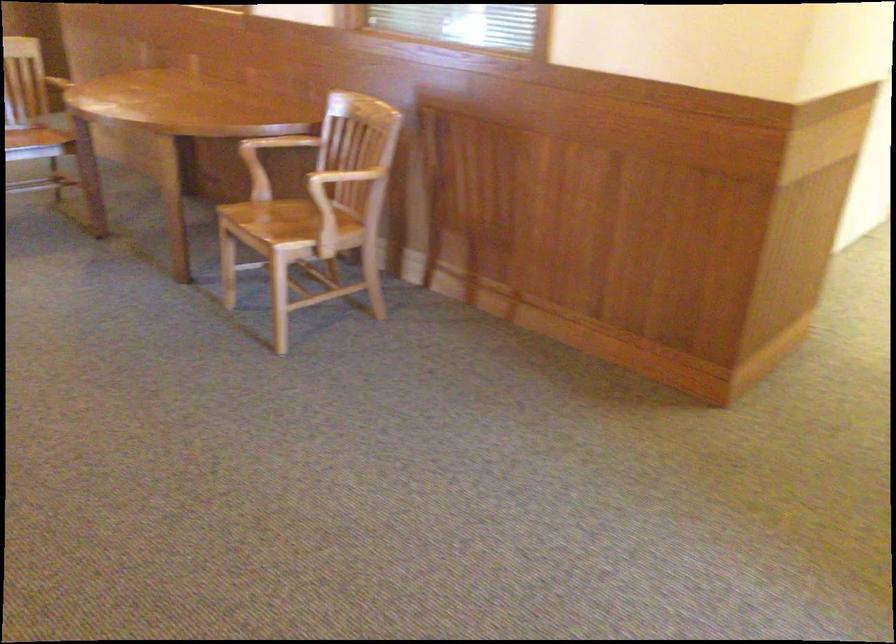
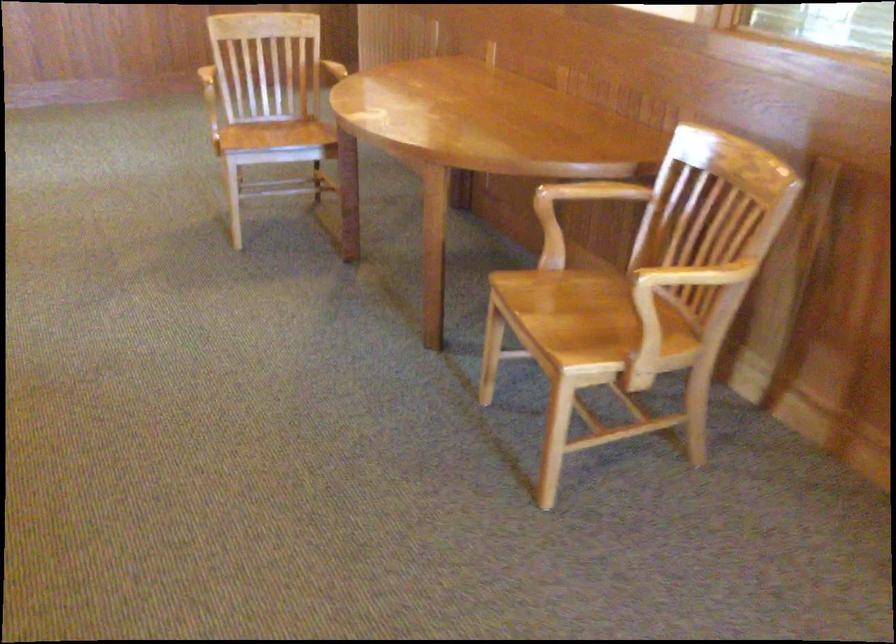
Locate, in the second image, the point that corresponds to [273,142] in the first image.

(587, 194)